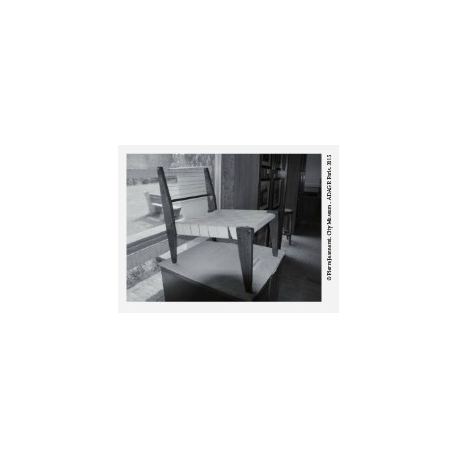
Locate an element on the screen. The width and height of the screenshot is (458, 458). table top is located at coordinates (211, 263).